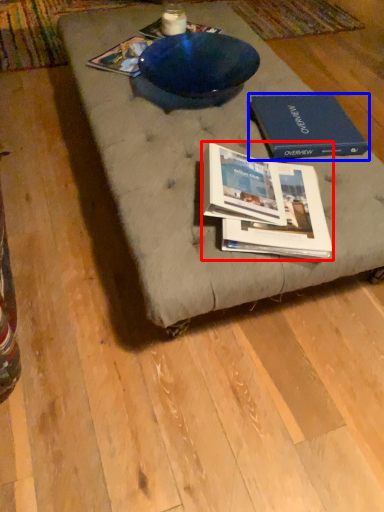
Question: Which of the following is the closest to the observer, book (highlighted by a red box) or paperback book (highlighted by a blue box)?

Choices:
 (A) book
 (B) paperback book

Answer: (A)